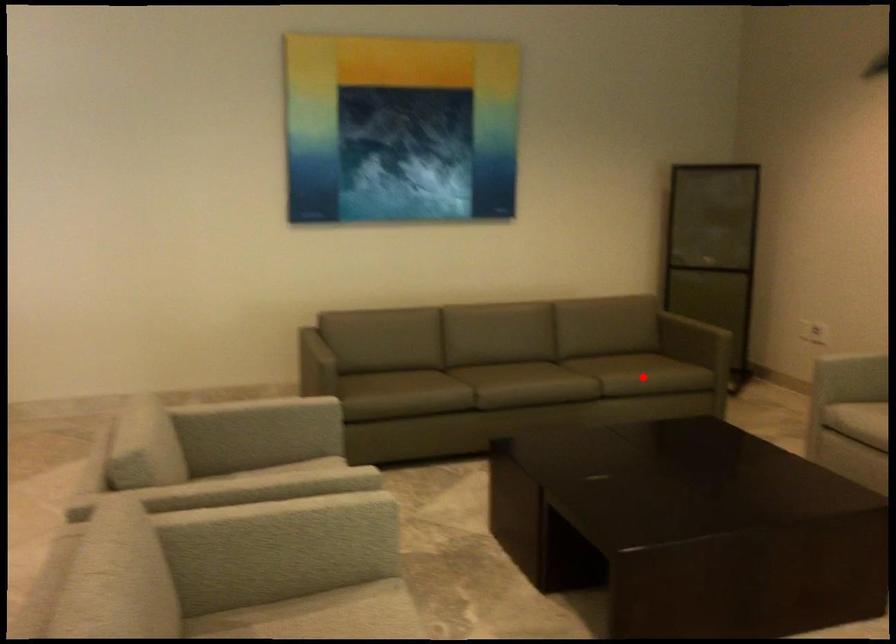
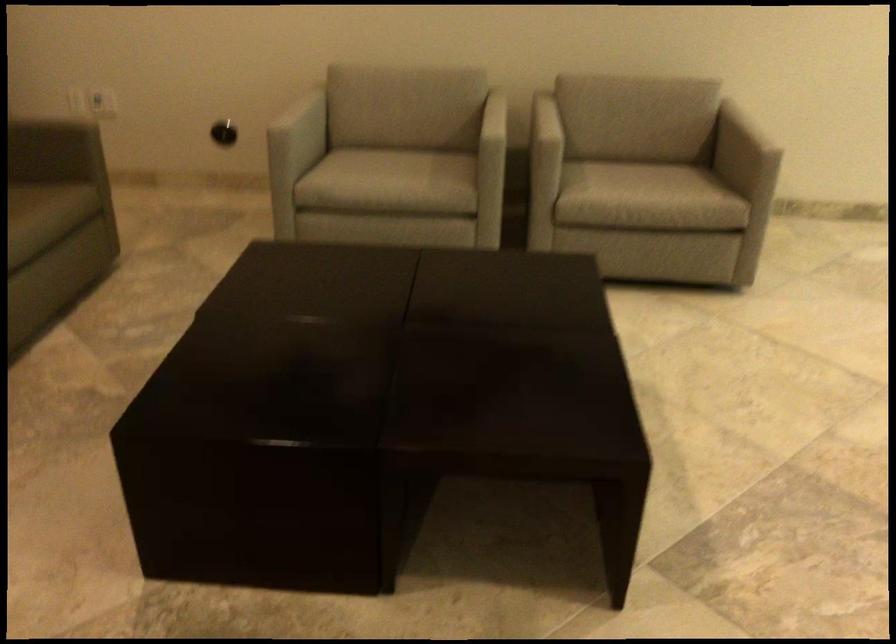
Where in the second image is the point corresponding to the highlighted location from the first image?

(36, 219)